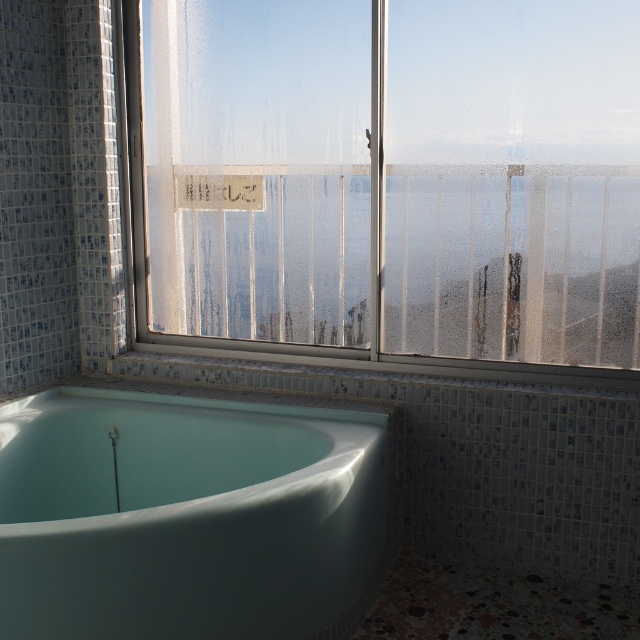
You are standing in the bathroom and want to take a photo of the frosted glass window at upper center using a camera. The camera requires a minimum distance of 2 meters to focus properly. Can you take a clear photo from your current position?

The frosted glass window at upper center and camera are 2.46 meters apart, which is more than the required 2 meters. Therefore, you can take a clear photo from your current position.

You are a contractor assessing the bathroom layout. You need to install a new showerhead that requires a 1.2 meter clearance above the matte white bathtub at lower left. Does the frosted glass window at upper center interfere with this installation?

The frosted glass window at upper center is located above the matte white bathtub at lower left, so it may interfere with the installation of the showerhead if the distance between them is less than 1.2 meters. However, the exact clearance isn not provided in the description, so further measurements are needed to confirm.

You are a contractor planning to install a new shower enclosure in the bathroom. The shower enclosure requires a space that is wider than the frosted glass window at upper center. Can the matte white bathtub at lower left be moved to accommodate this requirement?

The frosted glass window at upper center is wider than the matte white bathtub at lower left. Since the shower enclosure needs to be wider than the window, moving the bathtub would not provide sufficient space as the bathtub itself is narrower than the window. Therefore, the matte white bathtub at lower left cannot be moved to meet the required width for the shower enclosure.